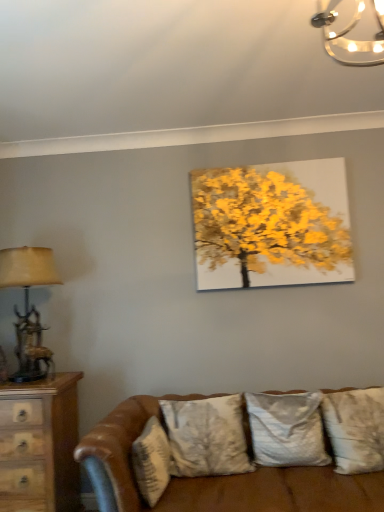
Question: Is wooden chest of drawers at left bigger than antler bronze table lamp at left?

Choices:
 (A) no
 (B) yes

Answer: (B)

Question: From a real-world perspective, does wooden chest of drawers at left stand above antler bronze table lamp at left?

Choices:
 (A) yes
 (B) no

Answer: (B)

Question: Considering the relative sizes of wooden chest of drawers at left and antler bronze table lamp at left in the image provided, is wooden chest of drawers at left thinner than antler bronze table lamp at left?

Choices:
 (A) no
 (B) yes

Answer: (A)

Question: From the image's perspective, is wooden chest of drawers at left on top of antler bronze table lamp at left?

Choices:
 (A) yes
 (B) no

Answer: (B)

Question: Is wooden chest of drawers at left positioned in front of antler bronze table lamp at left?

Choices:
 (A) no
 (B) yes

Answer: (B)

Question: From the image's perspective, is wooden chest of drawers at left beneath antler bronze table lamp at left?

Choices:
 (A) yes
 (B) no

Answer: (A)

Question: From a real-world perspective, is silky gray pillow at center, which appears as the third pillow when viewed from the left, positioned over textured beige pillow at lower right, the 1th pillow when ordered from right to left, based on gravity?

Choices:
 (A) yes
 (B) no

Answer: (A)

Question: Considering the relative sizes of silky gray pillow at center, which appears as the third pillow when viewed from the left, and textured beige pillow at lower right, which is counted as the 4th pillow, starting from the left, in the image provided, is silky gray pillow at center, which appears as the third pillow when viewed from the left, thinner than textured beige pillow at lower right, which is counted as the 4th pillow, starting from the left,?

Choices:
 (A) no
 (B) yes

Answer: (B)

Question: Is silky gray pillow at center, which appears as the third pillow when viewed from the left, not within textured beige pillow at lower right, the 1th pillow when ordered from right to left?

Choices:
 (A) no
 (B) yes

Answer: (B)

Question: From the image's perspective, would you say silky gray pillow at center, marked as the second pillow in a right-to-left arrangement, is shown under textured beige pillow at lower right, the 1th pillow when ordered from right to left?

Choices:
 (A) no
 (B) yes

Answer: (B)

Question: Would you say textured beige pillow at lower right, the 1th pillow when ordered from right to left, is part of silky gray pillow at center, marked as the second pillow in a right-to-left arrangement,'s contents?

Choices:
 (A) yes
 (B) no

Answer: (B)

Question: From a real-world perspective, is silky gray pillow at center, which appears as the third pillow when viewed from the left, located beneath textured beige pillow at lower right, the 1th pillow when ordered from right to left?

Choices:
 (A) no
 (B) yes

Answer: (A)

Question: Can you confirm if silky white pillow at center, the 2th pillow viewed from the left, is thinner than metallic glass chandelier at upper right?

Choices:
 (A) yes
 (B) no

Answer: (B)